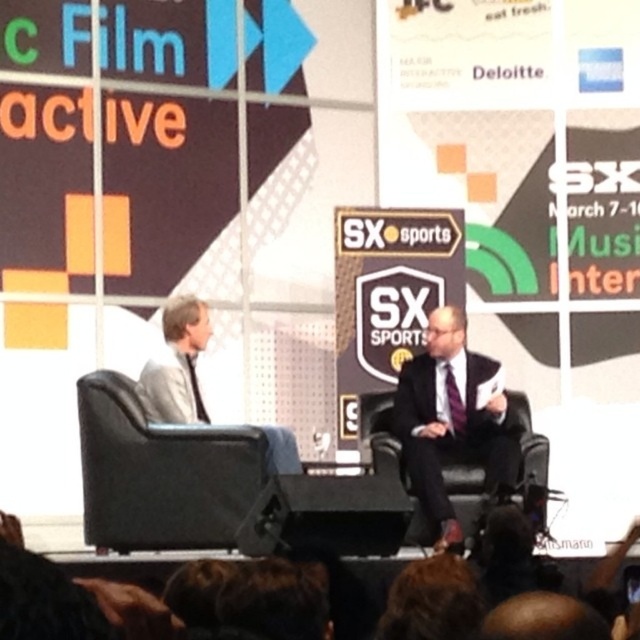
Looking at this image, which of these two, brown hair at lower center or black fabric camera at lower center, stands shorter?

Standing shorter between the two is brown hair at lower center.

From the picture: Who is more forward, (458, 627) or (481, 540)?

Positioned in front is point (458, 627).

At what (x,y) coordinates should I click in order to perform the action: click on brown hair at lower center. Please return your answer as a coordinate pair (x, y). Looking at the image, I should click on (433, 600).

Is point (504, 458) more distant than point (513, 550)?

Yes.

Who is positioned more to the left, dark suit at center or black fabric camera at lower center?

black fabric camera at lower center

The image size is (640, 640). Identify the location of dark suit at center. (452, 419).

Locate an element on the screen. The image size is (640, 640). dark suit at center is located at coordinates (452, 419).

Between dark suit at center and purple satin tie at center, which one appears on the left side from the viewer's perspective?

Positioned to the left is purple satin tie at center.

Is dark suit at center bigger than purple satin tie at center?

No, dark suit at center is not bigger than purple satin tie at center.

This screenshot has height=640, width=640. I want to click on dark suit at center, so click(x=452, y=419).